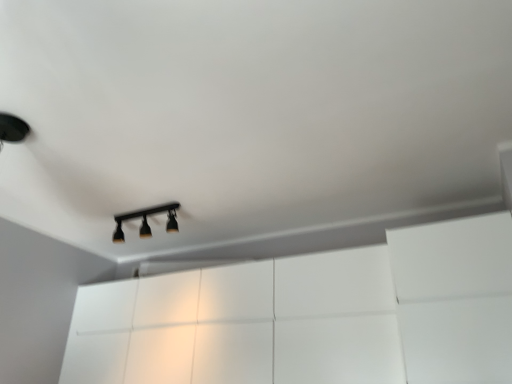
Question: Is white glossy dresser at center wider or thinner than black matte track light at center?

Choices:
 (A) thin
 (B) wide

Answer: (B)

Question: Is point (382, 311) closer or farther from the camera than point (159, 208)?

Choices:
 (A) farther
 (B) closer

Answer: (B)

Question: Choose the correct answer: Is white glossy dresser at center inside black matte track light at center or outside it?

Choices:
 (A) outside
 (B) inside

Answer: (A)

Question: Is black matte track light at center to the left or to the right of white glossy dresser at center in the image?

Choices:
 (A) left
 (B) right

Answer: (A)

Question: From a real-world perspective, is black matte track light at center physically located above or below white glossy dresser at center?

Choices:
 (A) above
 (B) below

Answer: (A)

Question: Is black matte track light at center taller or shorter than white glossy dresser at center?

Choices:
 (A) tall
 (B) short

Answer: (B)

Question: In the image, is black matte track light at center positioned in front of or behind white glossy dresser at center?

Choices:
 (A) behind
 (B) front

Answer: (A)